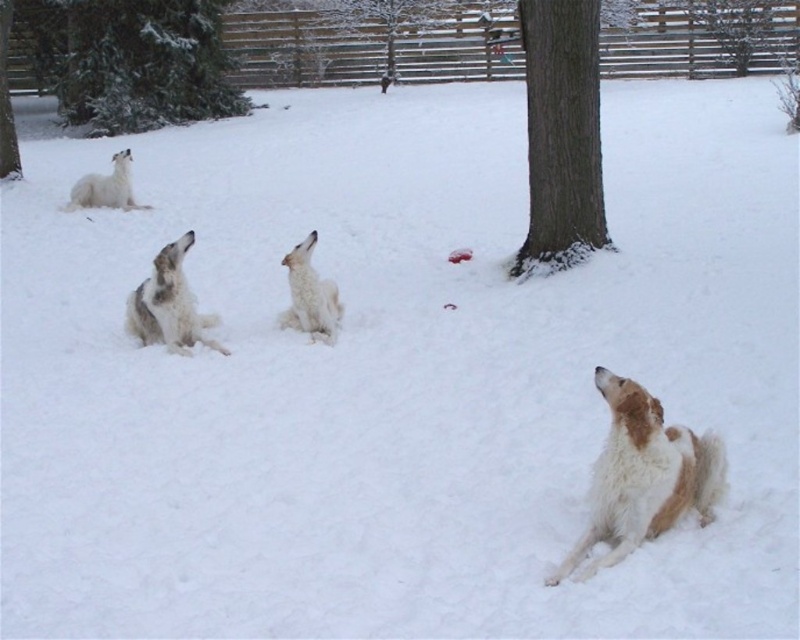
You are standing at the point where the snow is undisturbed except for the dogs footprints. You want to take a photo of the fourth dog located at point (x=184, y=285). If your camera has a maximum focus range of 7 meters, will you be able to capture the fourth dog clearly?

The distance of point (x=184, y=285) from viewer is 7.31 meters. Since the camera can only focus up to 7 meters, the fourth dog will be out of focus and not captured clearly.

You are standing at the origin point in the snowy scene. Which direction should you move to reach the white fur dog at center?

To reach the white fur dog at center located at point 0.477 on the x axis and 0.212 on the y axis, you should move northeast since the coordinates are positive in both x and y directions.